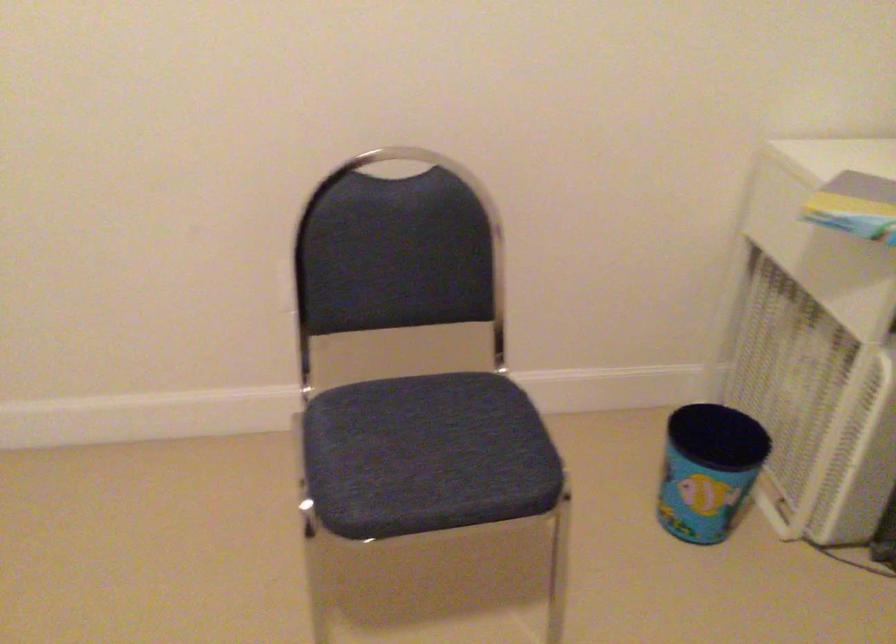
Find the location of a particular element. The image size is (896, 644). chair sitting surface is located at coordinates (426, 455).